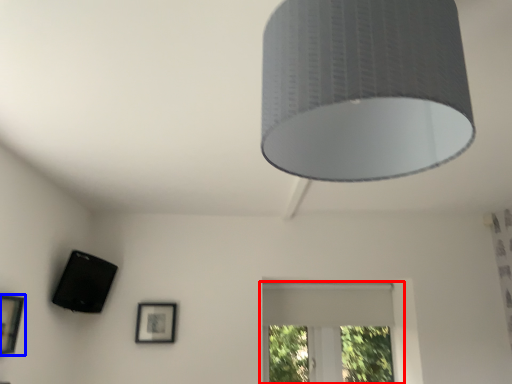
Question: Which point is closer to the camera, window (highlighted by a red box) or picture frame (highlighted by a blue box)?

Choices:
 (A) window
 (B) picture frame

Answer: (B)